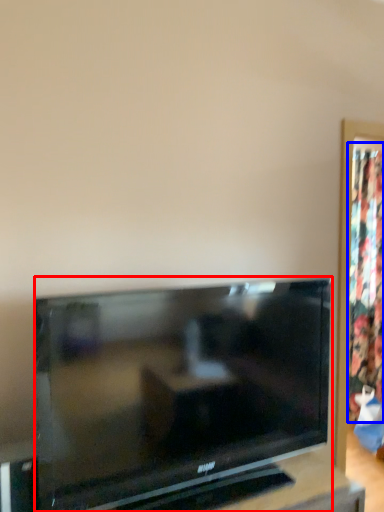
Question: Among these objects, which one is nearest to the camera, television (highlighted by a red box) or curtain (highlighted by a blue box)?

Choices:
 (A) television
 (B) curtain

Answer: (A)